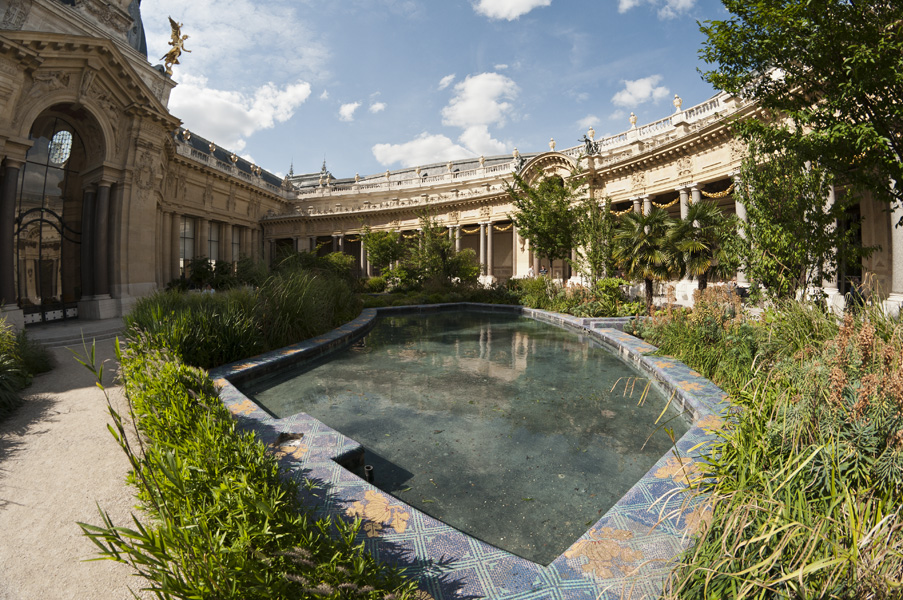
Locate an element on the screen. This screenshot has width=903, height=600. archway is located at coordinates (62, 102).